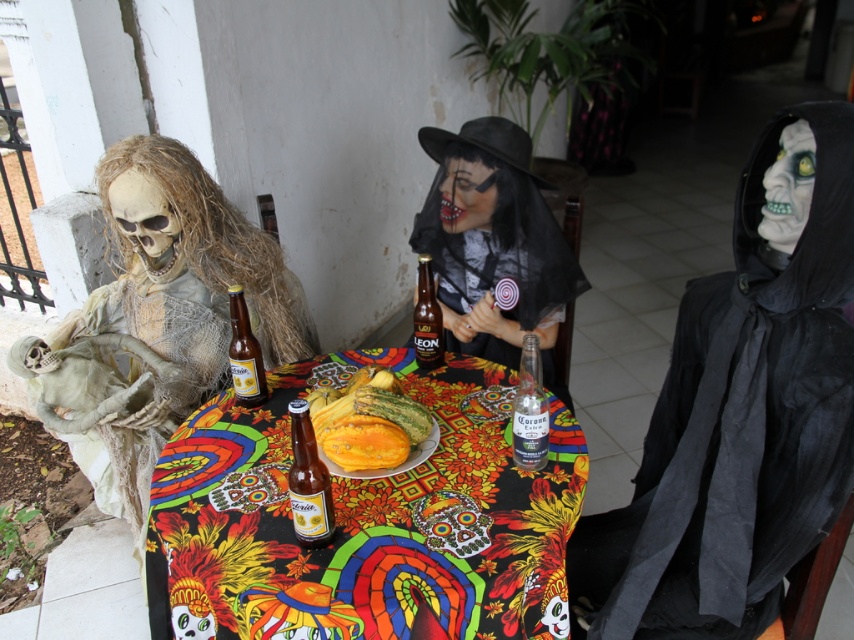
You are a guest at a DIA DE LOS MUERTOS celebration and want to place a small candle between the matte white skeleton at left and the brown glass beer bottle at center. Which object should you place the candle closer to to ensure it doesn not tip over?

The matte white skeleton at left is taller than the brown glass beer bottle at center, so placing the candle closer to the brown glass beer bottle at center would provide a more stable base since it is shorter and less likely to tip over.

You are standing at the camera position and want to take a photo of the matte white skeleton at left. Can you reach it without moving? The camera has a 10 feet reach range.

The matte white skeleton at left and camera are 5.02 feet apart, so yes, you can reach it without moving since it is within the camera reach range.

Consider the image. You are standing in front of the table at the DIA DE LOS MUERTOS celebration. You need to grab the black matte hood at right and the translucent glass beer bottle at center. Which object should you reach for first to pick them up in the correct order based on their positions?

You should reach for the black matte hood at right first because it is closer to you than the translucent glass beer bottle at center.